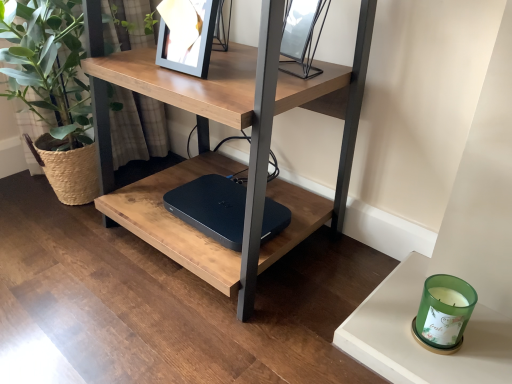
Question: From the image's perspective, is metallic silver picture frame at upper center beneath matte wood table at center?

Choices:
 (A) no
 (B) yes

Answer: (A)

Question: Is metallic silver picture frame at upper center wider than matte wood table at center?

Choices:
 (A) yes
 (B) no

Answer: (B)

Question: Could you tell me if metallic silver picture frame at upper center is facing matte wood table at center?

Choices:
 (A) no
 (B) yes

Answer: (B)

Question: Is metallic silver picture frame at upper center positioned with its back to matte wood table at center?

Choices:
 (A) no
 (B) yes

Answer: (B)

Question: Is metallic silver picture frame at upper center in contact with matte wood table at center?

Choices:
 (A) yes
 (B) no

Answer: (B)

Question: From a real-world perspective, relative to black matte laptop at center, is green glass candle at lower right vertically above or below?

Choices:
 (A) above
 (B) below

Answer: (B)

Question: From the image's perspective, is green glass candle at lower right positioned above or below black matte laptop at center?

Choices:
 (A) below
 (B) above

Answer: (A)

Question: Is green glass candle at lower right inside or outside of black matte laptop at center?

Choices:
 (A) outside
 (B) inside

Answer: (A)

Question: Looking at the image, does green glass candle at lower right seem bigger or smaller compared to black matte laptop at center?

Choices:
 (A) small
 (B) big

Answer: (A)

Question: Is black matte laptop at center wider or thinner than green woven basket at left?

Choices:
 (A) wide
 (B) thin

Answer: (B)

Question: Based on their positions, is black matte laptop at center located to the left or right of green woven basket at left?

Choices:
 (A) left
 (B) right

Answer: (B)

Question: Considering the positions of black matte laptop at center and green woven basket at left in the image, is black matte laptop at center taller or shorter than green woven basket at left?

Choices:
 (A) tall
 (B) short

Answer: (B)

Question: From the image's perspective, is black matte laptop at center positioned above or below green woven basket at left?

Choices:
 (A) below
 (B) above

Answer: (A)

Question: In the image, is green glass candle at lower right positioned in front of or behind metallic silver picture frame at upper center?

Choices:
 (A) behind
 (B) front

Answer: (B)

Question: Is point (452, 304) positioned closer to the camera than point (294, 34)?

Choices:
 (A) farther
 (B) closer

Answer: (B)